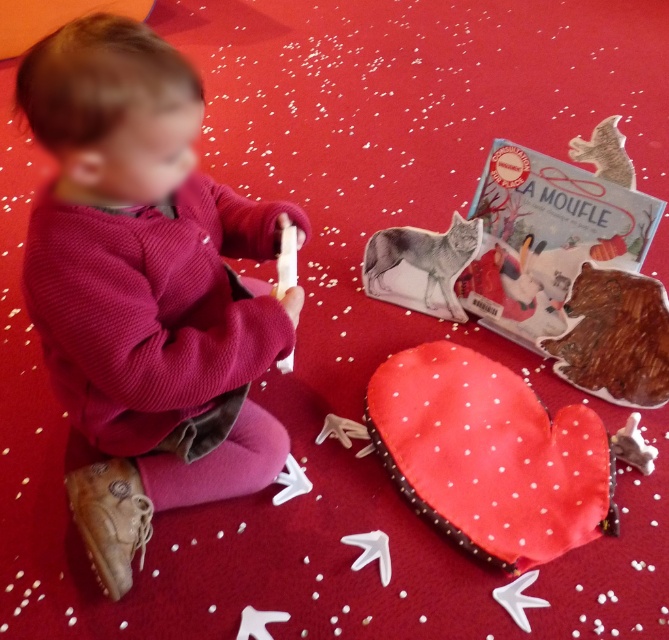
You are a photographer taking a picture of the scene described. You need to place a sticker on the exact location of the velvety pink sweater at left. What are the coordinates where you should place the sticker?

The coordinates for the velvety pink sweater at left are at point (x=145, y=289).